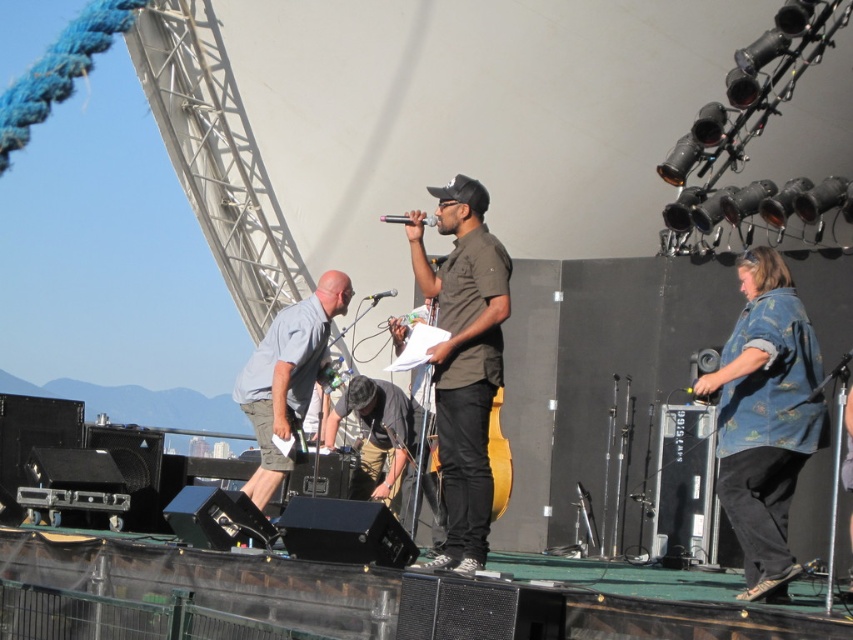
Is point (456, 232) more distant than point (410, 221)?

That is True.

Can you confirm if dark brown shirt at center is bigger than black plastic microphone at center?

Correct, dark brown shirt at center is larger in size than black plastic microphone at center.

Locate an element on the screen. The height and width of the screenshot is (640, 853). dark brown shirt at center is located at coordinates (463, 360).

At what (x,y) coordinates should I click in order to perform the action: click on dark brown shirt at center. Please return your answer as a coordinate pair (x, y). This screenshot has width=853, height=640. Looking at the image, I should click on (463, 360).

Is point (364, 417) positioned in front of point (379, 291)?

Yes, it is in front of point (379, 291).

Which is behind, point (392, 388) or point (386, 296)?

Positioned behind is point (386, 296).

The width and height of the screenshot is (853, 640). In order to click on dark gray fabric at center in this screenshot , I will do `click(375, 436)`.

Which is behind, point (445, 312) or point (376, 296)?

Point (376, 296)

Between dark brown shirt at center and black matte microphone at center, which one appears on the right side from the viewer's perspective?

Positioned to the right is dark brown shirt at center.

The width and height of the screenshot is (853, 640). What do you see at coordinates (463, 360) in the screenshot?
I see `dark brown shirt at center` at bounding box center [463, 360].

You are a GUI agent. You are given a task and a screenshot of the screen. Output one action in this format:
    pyautogui.click(x=<x>, y=<y>)
    Task: Click on the dark brown shirt at center
    Image resolution: width=853 pixels, height=640 pixels.
    Given the screenshot: What is the action you would take?
    pyautogui.click(x=463, y=360)